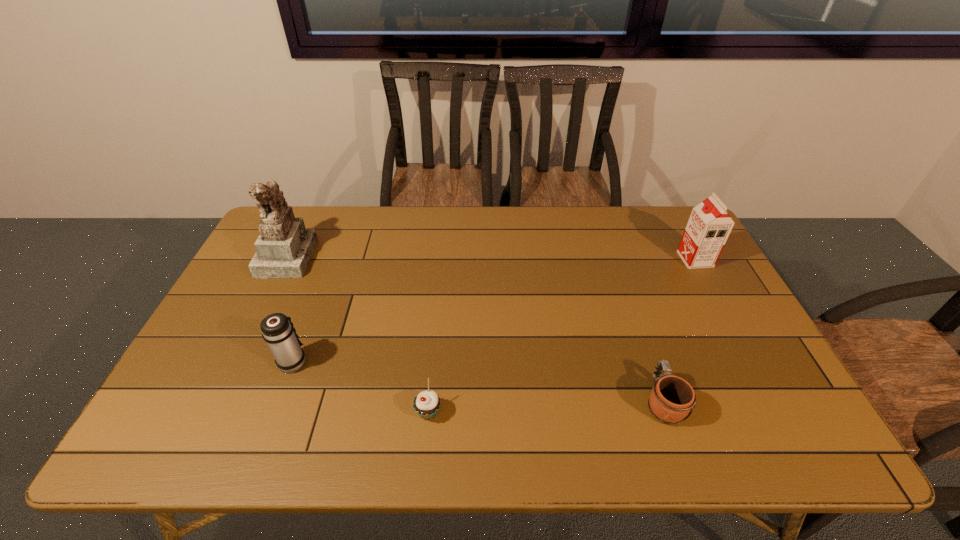
Locate an element on the screen. figurine is located at coordinates (284, 247).

Where is `the tallest object`? the tallest object is located at coordinates (284, 247).

The height and width of the screenshot is (540, 960). Find the location of `the rightmost object`. the rightmost object is located at coordinates (709, 225).

What are the coordinates of `soya milk` in the screenshot? It's located at 709,225.

The width and height of the screenshot is (960, 540). Find the location of `the third tallest object`. the third tallest object is located at coordinates (277, 329).

Locate an element on the screen. the third farthest object is located at coordinates (277, 329).

At what (x,y) coordinates should I click in order to perform the action: click on cupcake. Please return your answer as a coordinate pair (x, y). Looking at the image, I should click on (426, 404).

Where is `mug`? The image size is (960, 540). mug is located at coordinates (671, 401).

The width and height of the screenshot is (960, 540). Identify the location of free point located on the front-facing side of the figurine. (365, 256).

This screenshot has height=540, width=960. I want to click on free space located 0.120m on the back of the soya milk, so click(x=678, y=228).